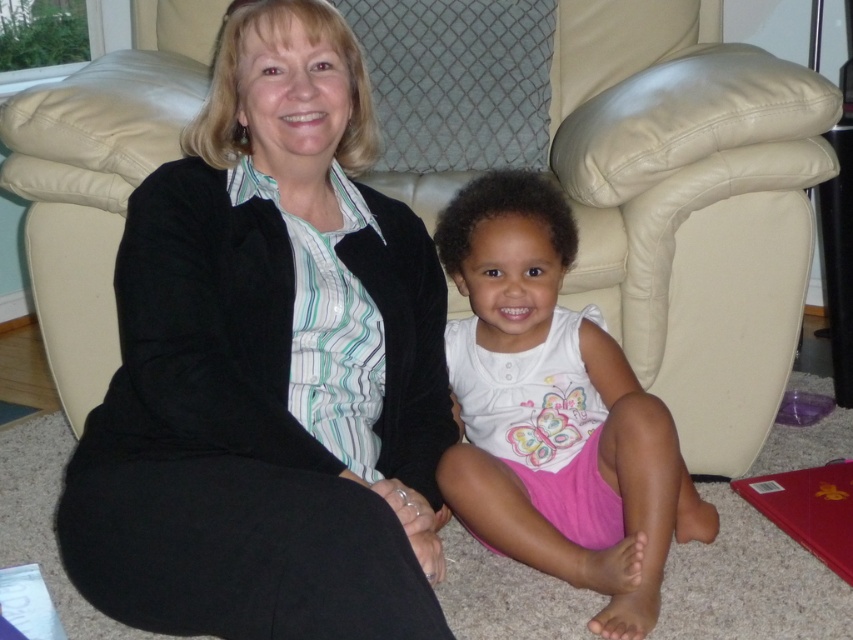
What do you see at coordinates (270, 369) in the screenshot? I see `velvet black jacket at center` at bounding box center [270, 369].

Does velvet black jacket at center appear on the left side of beige leather armchair at center?

Yes, velvet black jacket at center is to the left of beige leather armchair at center.

Between point (158, 312) and point (616, 220), which one is positioned in front?

Positioned in front is point (158, 312).

This screenshot has width=853, height=640. In order to click on velvet black jacket at center in this screenshot , I will do `click(270, 369)`.

Is point (595, 262) closer to viewer compared to point (616, 433)?

No, (595, 262) is further to viewer.

Which is in front, point (558, 33) or point (508, 237)?

Point (508, 237) is more forward.

The image size is (853, 640). I want to click on beige leather armchair at center, so click(689, 205).

Between velvet black jacket at center and white cotton shirt at center, which one is positioned lower?

white cotton shirt at center is lower down.

Can you confirm if velvet black jacket at center is shorter than white cotton shirt at center?

No, velvet black jacket at center is not shorter than white cotton shirt at center.

Is point (216, 378) closer to camera compared to point (624, 529)?

Yes, point (216, 378) is closer to viewer.

The width and height of the screenshot is (853, 640). Find the location of `velvet black jacket at center`. velvet black jacket at center is located at coordinates (270, 369).